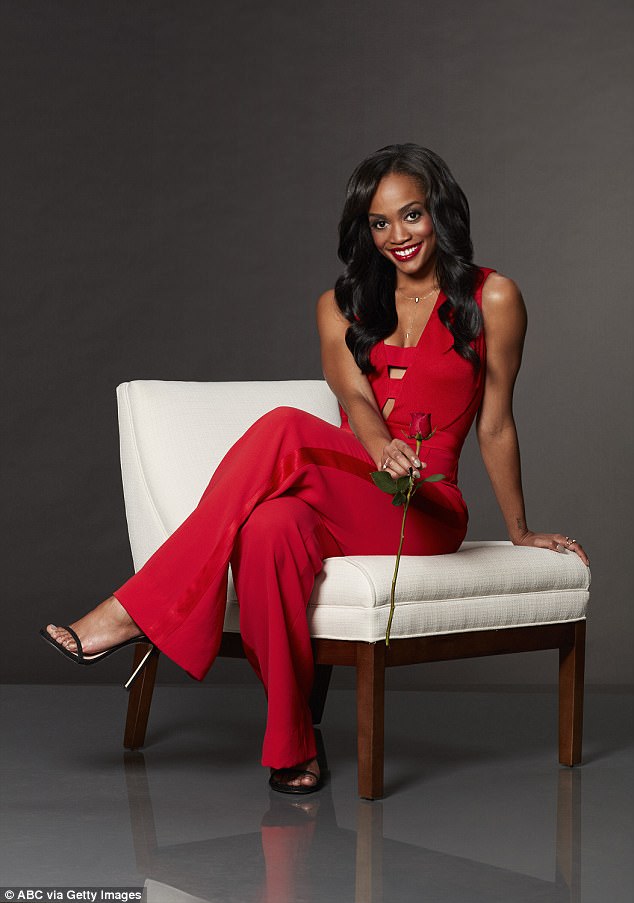
Identify the location of chair. (158, 435).